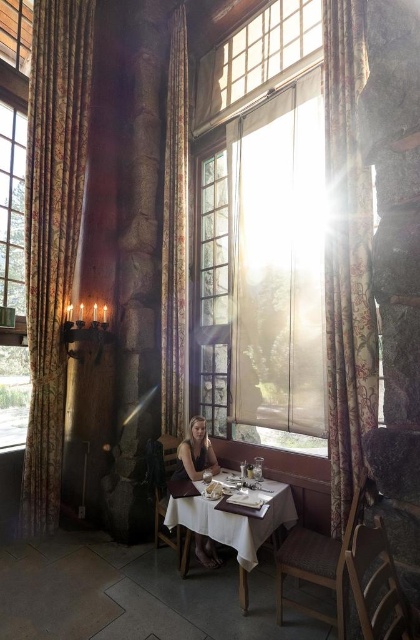
You are a guest in this dining area and want to place your phone on the closest available surface. The gold floral fabric curtain at left and the white paper napkin at center are both in your line of sight. Which one is closer to you?

The white paper napkin at center is closer to you because it is below the gold floral fabric curtain at left, which is positioned above it.